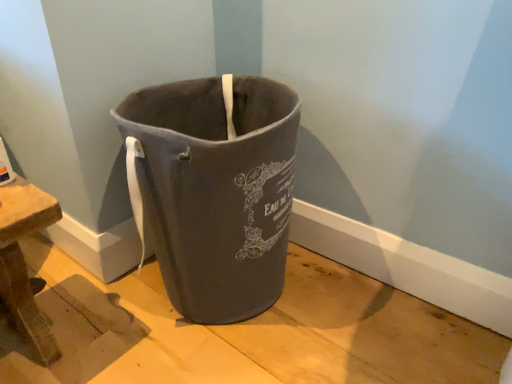
Locate an element on the screen. This screenshot has width=512, height=384. free space to the right of matte gray fabric bucket at center is located at coordinates (344, 300).